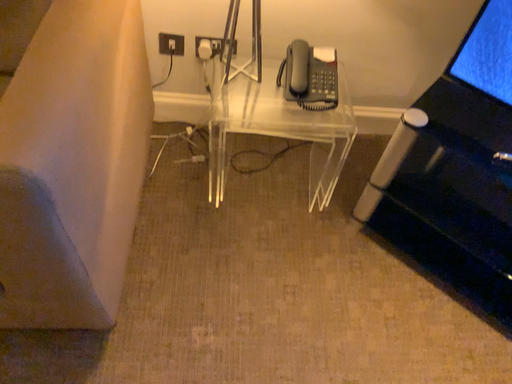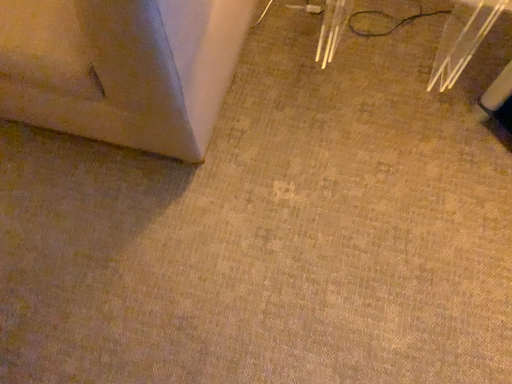
Question: Which way did the camera rotate in the video?

Choices:
 (A) rotated downward
 (B) rotated upward

Answer: (A)